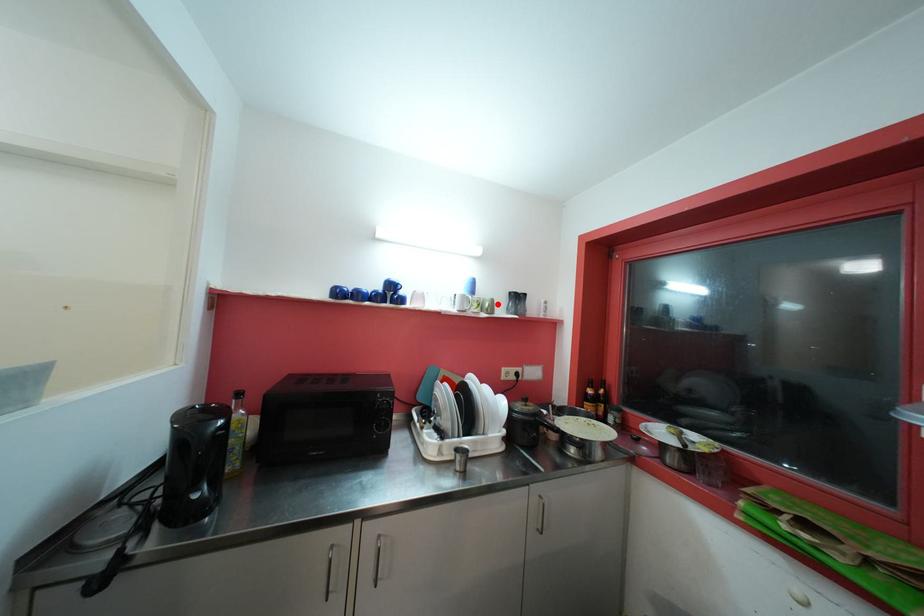
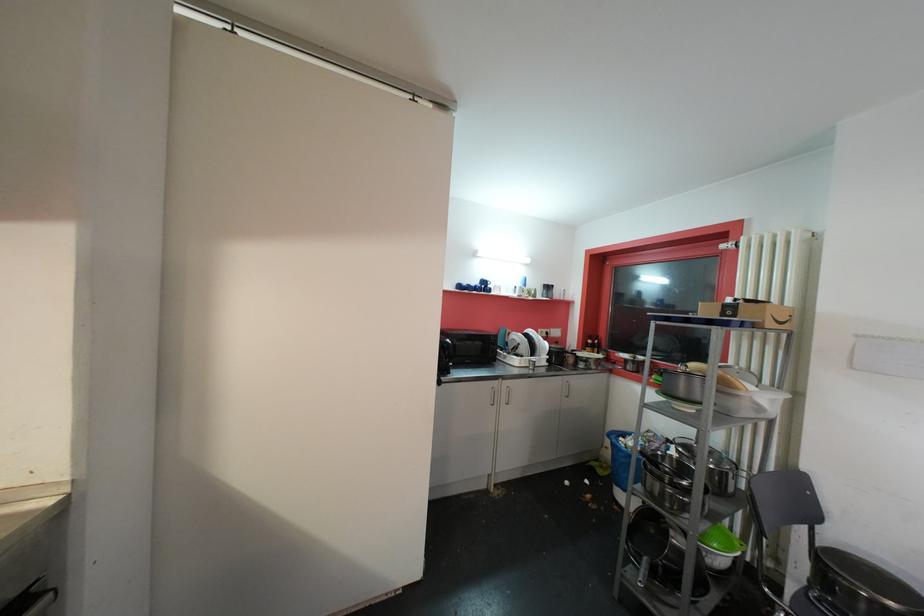
Locate, in the second image, the point that corresponds to the highlighted location in the first image.

(541, 293)